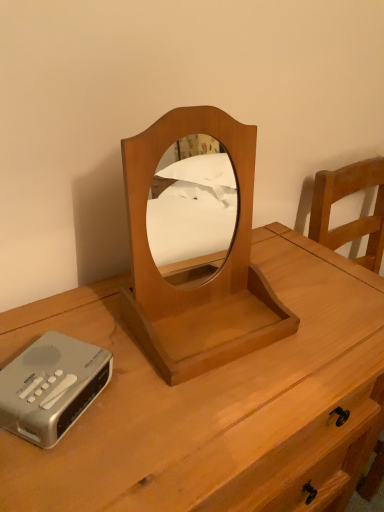
Question: Does wooden mirror at center lie in front of silver metallic cassette at lower left?

Choices:
 (A) yes
 (B) no

Answer: (A)

Question: Is silver metallic cassette at lower left at the back of wooden mirror at center?

Choices:
 (A) no
 (B) yes

Answer: (A)

Question: Can you confirm if wooden mirror at center is positioned to the right of silver metallic cassette at lower left?

Choices:
 (A) yes
 (B) no

Answer: (A)

Question: Does wooden mirror at center have a smaller size compared to silver metallic cassette at lower left?

Choices:
 (A) yes
 (B) no

Answer: (B)

Question: Can silver metallic cassette at lower left be found inside wooden mirror at center?

Choices:
 (A) yes
 (B) no

Answer: (B)

Question: Is wooden mirror at center not near silver metallic cassette at lower left?

Choices:
 (A) yes
 (B) no

Answer: (B)

Question: Is wooden mirror at center aimed at light brown wood nightstand at center?

Choices:
 (A) yes
 (B) no

Answer: (B)

Question: From the image's perspective, is wooden mirror at center on light brown wood nightstand at center?

Choices:
 (A) yes
 (B) no

Answer: (A)

Question: Considering the relative sizes of wooden mirror at center and light brown wood nightstand at center in the image provided, is wooden mirror at center thinner than light brown wood nightstand at center?

Choices:
 (A) yes
 (B) no

Answer: (A)

Question: Can you confirm if wooden mirror at center is taller than light brown wood nightstand at center?

Choices:
 (A) yes
 (B) no

Answer: (B)

Question: Considering the relative positions of wooden mirror at center and light brown wood nightstand at center in the image provided, is wooden mirror at center to the right of light brown wood nightstand at center from the viewer's perspective?

Choices:
 (A) no
 (B) yes

Answer: (B)

Question: From the image's perspective, does wooden mirror at center appear lower than light brown wood nightstand at center?

Choices:
 (A) yes
 (B) no

Answer: (B)

Question: Is silver metallic cassette at lower left wider than wooden mirror at center?

Choices:
 (A) yes
 (B) no

Answer: (B)